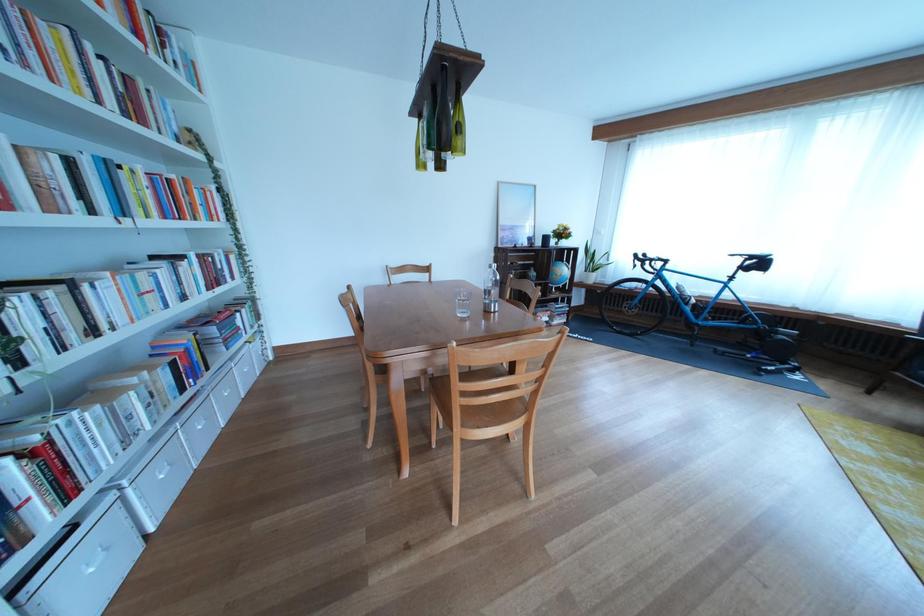
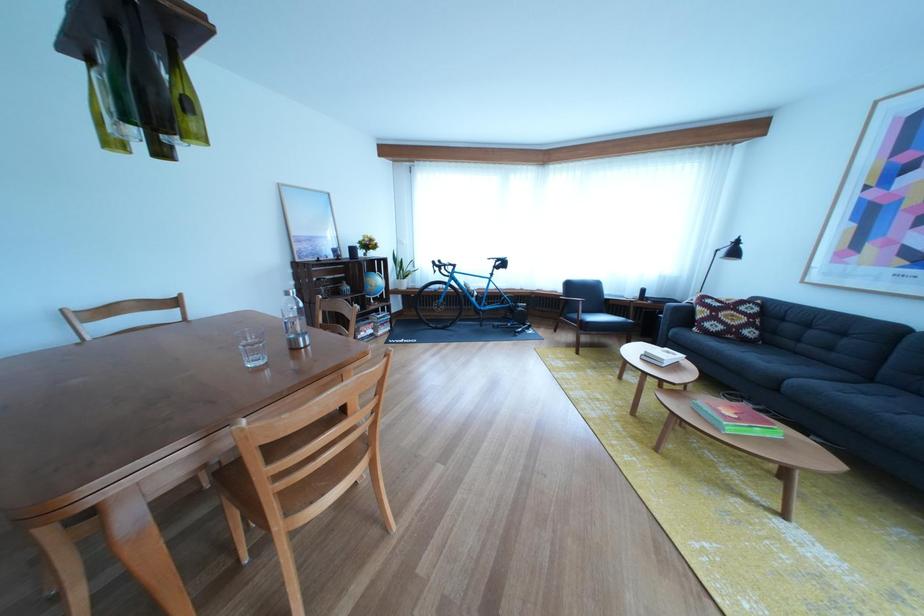
In the second image, find the point that corresponds to (589,256) in the first image.

(398, 265)